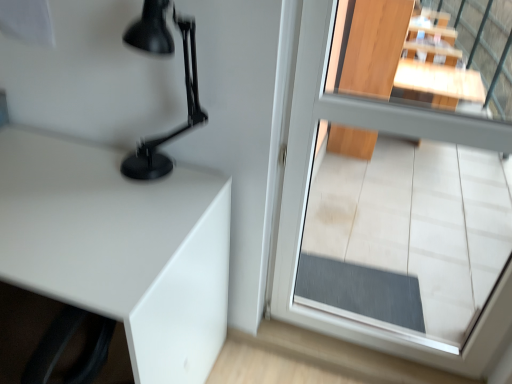
Question: Can you confirm if transparent glass door at center is positioned to the right of matte black lamp at upper left?

Choices:
 (A) yes
 (B) no

Answer: (A)

Question: Is the depth of transparent glass door at center greater than that of matte black lamp at upper left?

Choices:
 (A) yes
 (B) no

Answer: (B)

Question: Is transparent glass door at center to the left of matte black lamp at upper left from the viewer's perspective?

Choices:
 (A) no
 (B) yes

Answer: (A)

Question: Is transparent glass door at center positioned before matte black lamp at upper left?

Choices:
 (A) yes
 (B) no

Answer: (A)

Question: Is there a large distance between transparent glass door at center and matte black lamp at upper left?

Choices:
 (A) yes
 (B) no

Answer: (B)

Question: Is point (146, 173) positioned closer to the camera than point (442, 124)?

Choices:
 (A) closer
 (B) farther

Answer: (B)

Question: Considering the positions of matte black lamp at upper left and transparent glass door at center in the image, is matte black lamp at upper left taller or shorter than transparent glass door at center?

Choices:
 (A) short
 (B) tall

Answer: (A)

Question: Considering the positions of matte black lamp at upper left and transparent glass door at center in the image, is matte black lamp at upper left wider or thinner than transparent glass door at center?

Choices:
 (A) thin
 (B) wide

Answer: (B)

Question: In terms of size, does matte black lamp at upper left appear bigger or smaller than transparent glass door at center?

Choices:
 (A) small
 (B) big

Answer: (A)

Question: From a real-world perspective, is transparent glass door at center physically located above or below matte black lamp at upper left?

Choices:
 (A) below
 (B) above

Answer: (A)

Question: Looking at their shapes, would you say transparent glass door at center is wider or thinner than matte black lamp at upper left?

Choices:
 (A) thin
 (B) wide

Answer: (A)

Question: From the image's perspective, is transparent glass door at center positioned above or below matte black lamp at upper left?

Choices:
 (A) below
 (B) above

Answer: (A)

Question: Considering the positions of transparent glass door at center and matte black lamp at upper left in the image, is transparent glass door at center bigger or smaller than matte black lamp at upper left?

Choices:
 (A) big
 (B) small

Answer: (A)

Question: Is transparent glass door at center inside the boundaries of white glossy table at left, or outside?

Choices:
 (A) inside
 (B) outside

Answer: (B)

Question: Does point (428, 357) appear closer or farther from the camera than point (119, 215)?

Choices:
 (A) farther
 (B) closer

Answer: (A)